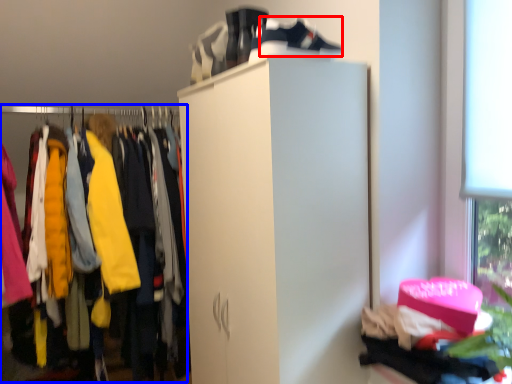
Question: Which point is further to the camera, shoe (highlighted by a red box) or closet (highlighted by a blue box)?

Choices:
 (A) shoe
 (B) closet

Answer: (B)